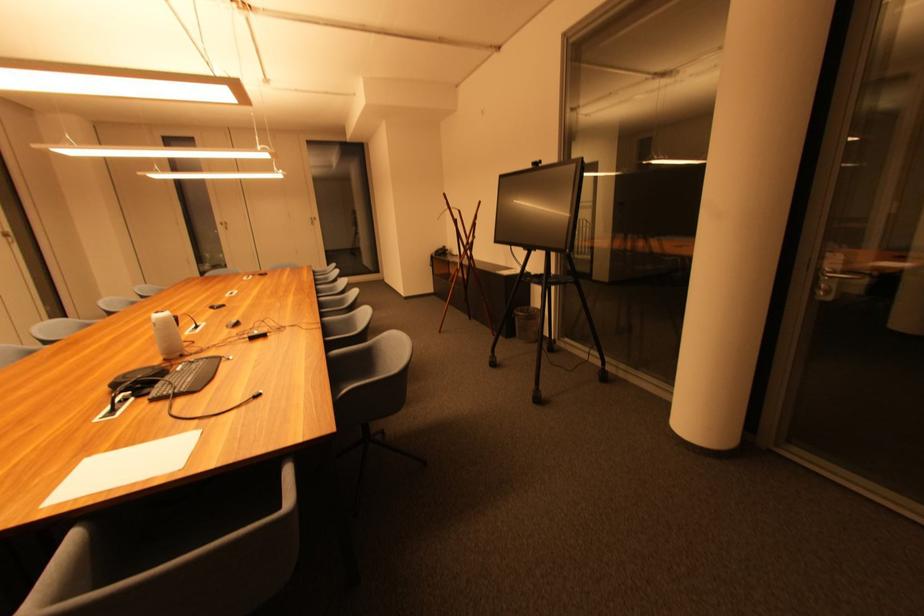
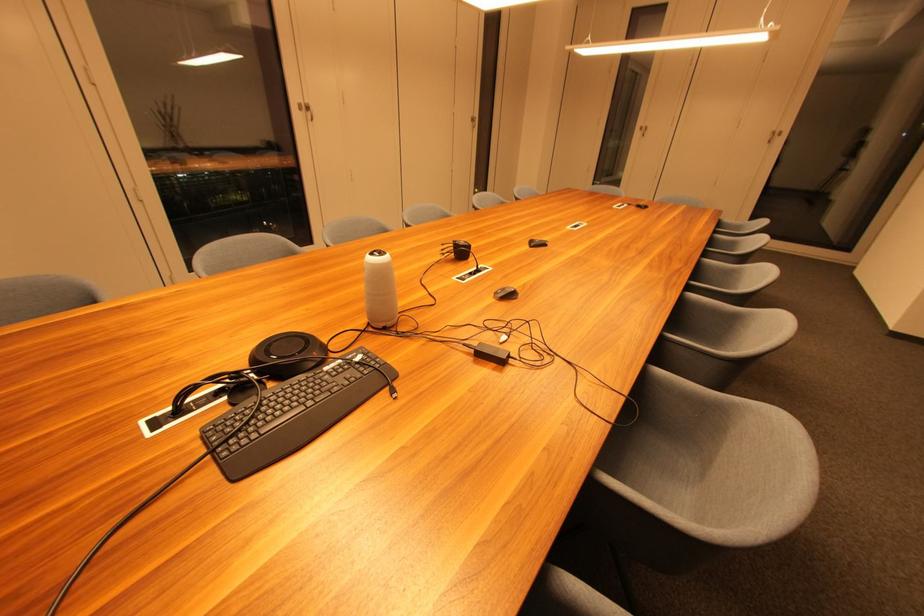
The point at (241, 326) is marked in the first image. Where is the corresponding point in the second image?

(515, 298)